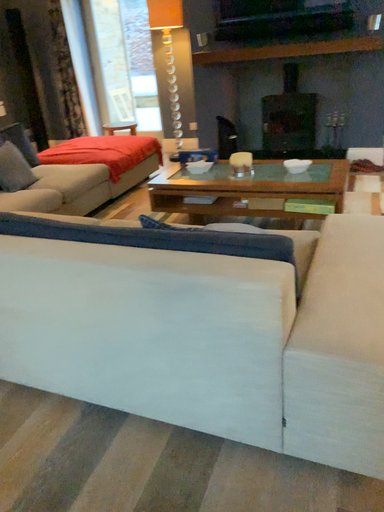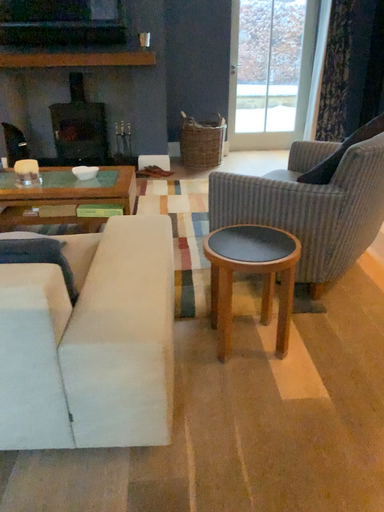
Question: How did the camera likely rotate when shooting the video?

Choices:
 (A) rotated left
 (B) rotated right

Answer: (B)